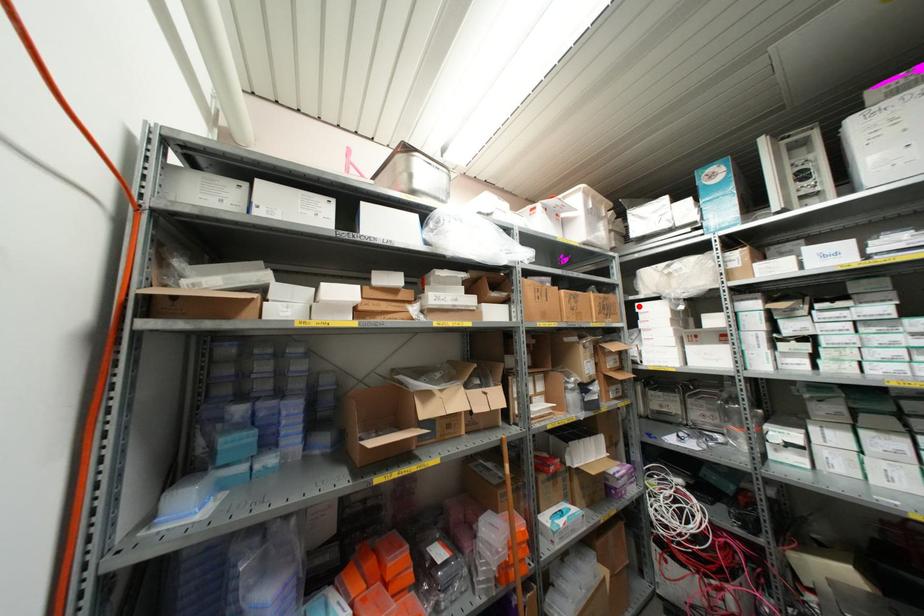
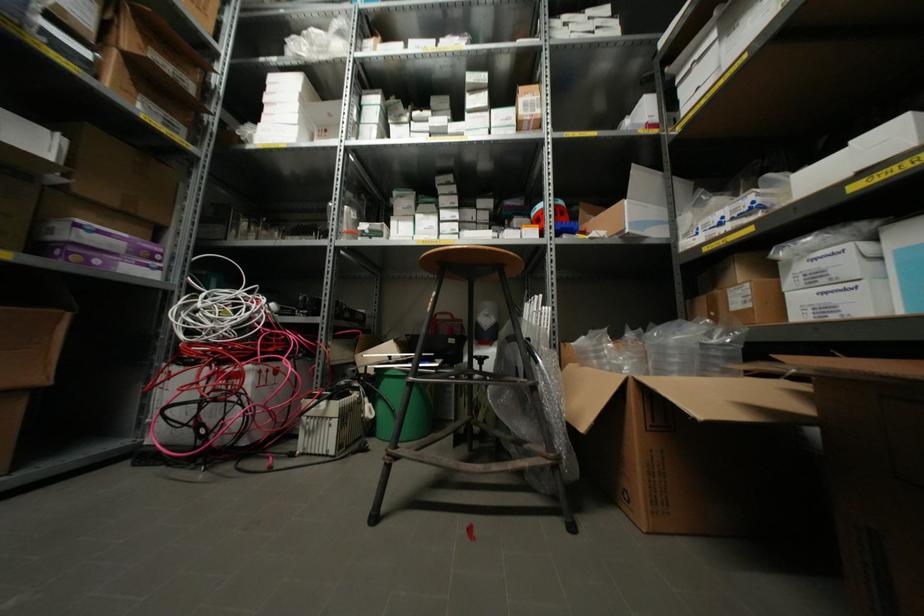
Find the pixel in the second image that matches the highlighted location in the first image.

(272, 79)